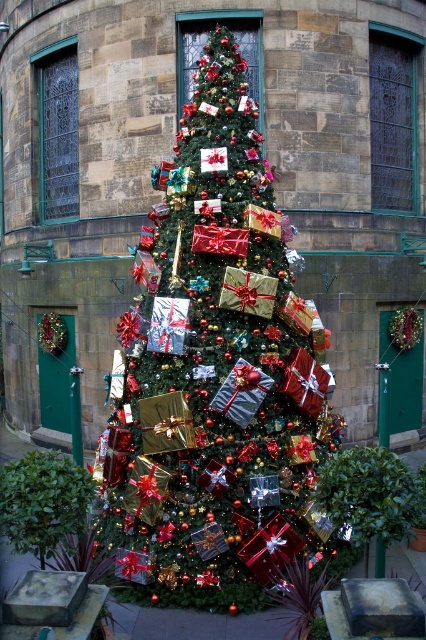
Who is positioned more to the right, shiny metallic tree at center or green leafy bush at lower left?

shiny metallic tree at center is more to the right.

Does shiny metallic tree at center have a greater width compared to green leafy bush at lower left?

Correct, the width of shiny metallic tree at center exceeds that of green leafy bush at lower left.

Does point (265, 260) lie behind point (77, 513)?

Yes, point (265, 260) is behind point (77, 513).

At what (x,y) coordinates should I click in order to perform the action: click on shiny metallic tree at center. Please return your answer as a coordinate pair (x, y). Looking at the image, I should click on (215, 371).